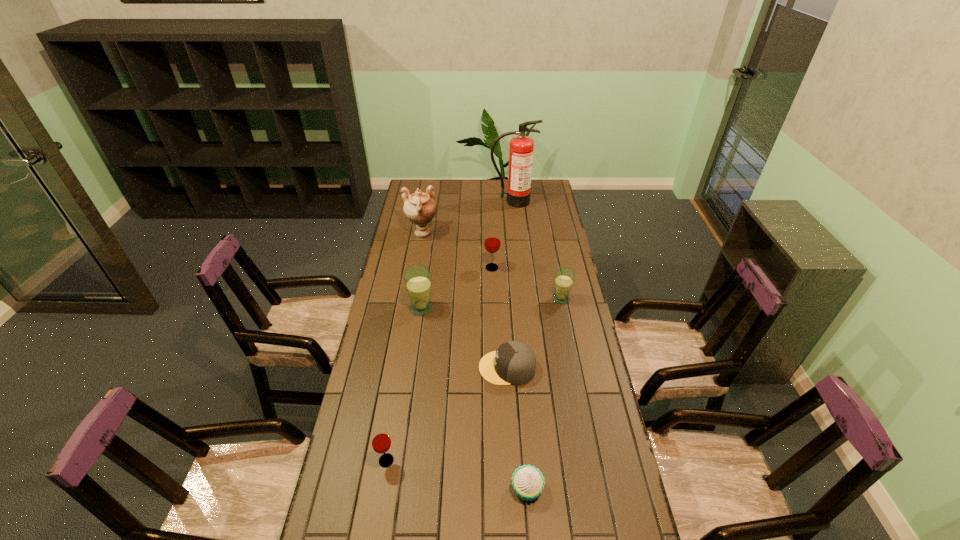
Locate an element on the screen. Image resolution: width=960 pixels, height=540 pixels. the left red glass is located at coordinates (381, 442).

This screenshot has width=960, height=540. In order to click on white cupcake in this screenshot , I will do `click(528, 482)`.

The height and width of the screenshot is (540, 960). Find the location of `cupcake`. cupcake is located at coordinates (528, 482).

You are a GUI agent. You are given a task and a screenshot of the screen. Output one action in this format:
    pyautogui.click(x=<x>, y=<y>)
    Task: Click on the gray cap
    The height and width of the screenshot is (540, 960).
    Given the screenshot: What is the action you would take?
    pyautogui.click(x=514, y=362)

At what (x,y) coordinates should I click in order to perform the action: click on cap. Please return your answer as a coordinate pair (x, y). Looking at the image, I should click on (514, 362).

Where is `blank area located on the front-facing side of the farthest object`? This screenshot has height=540, width=960. blank area located on the front-facing side of the farthest object is located at coordinates (515, 226).

The width and height of the screenshot is (960, 540). In order to click on blank space located on the back of the seventh shortest object in this screenshot , I will do `click(429, 192)`.

Identify the location of blank space located on the right of the bigger blue glass. This screenshot has width=960, height=540. (468, 308).

Identify the location of blank space located 0.140m on the right of the right red glass. The width and height of the screenshot is (960, 540). (532, 268).

The height and width of the screenshot is (540, 960). What are the coordinates of `vacant space located on the back of the rightmost glass` in the screenshot? It's located at (550, 241).